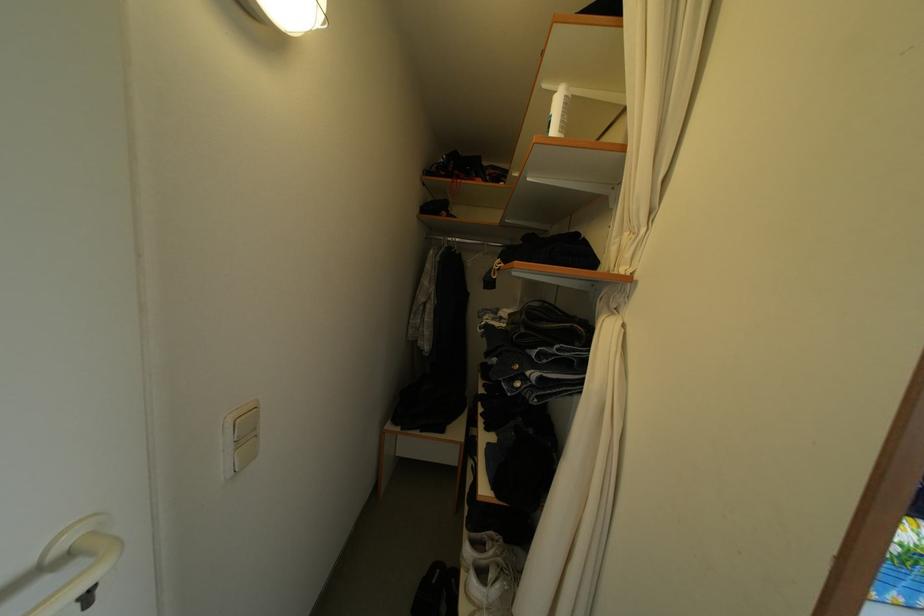
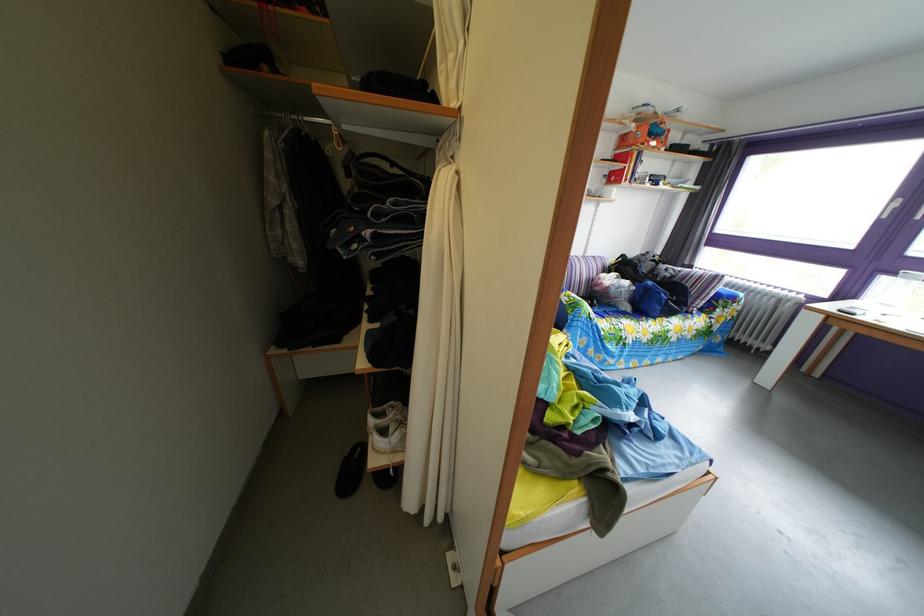
How did the camera likely rotate?

The rotation direction of the camera is right-down.